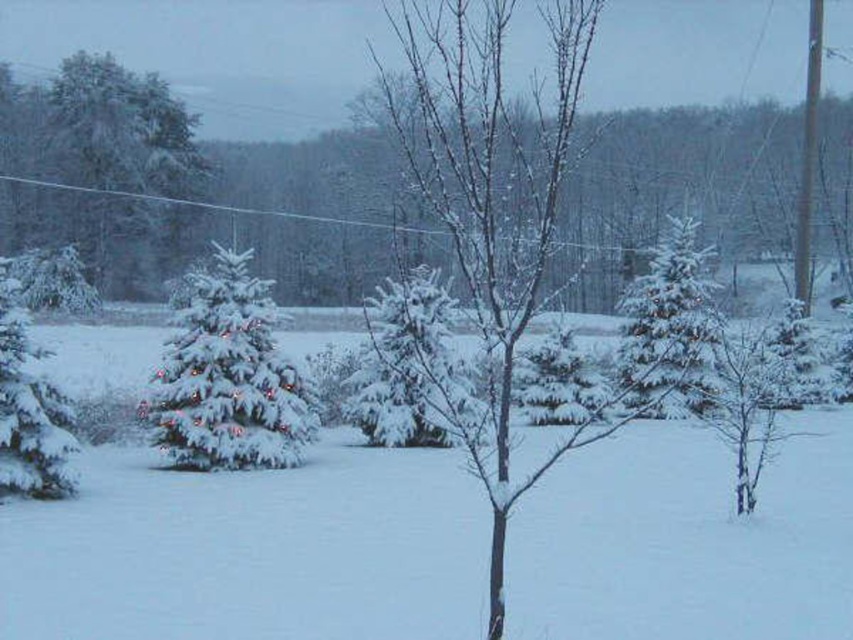
Is the position of green matte evergreen at left more distant than that of smooth bark tree at right?

Yes.

Is point (6, 269) in front of point (766, 369)?

No, it is not.

What do you see at coordinates (28, 406) in the screenshot? I see `green matte evergreen at left` at bounding box center [28, 406].

The height and width of the screenshot is (640, 853). I want to click on green matte evergreen at left, so click(x=28, y=406).

Can you confirm if snow-covered tree at center is shorter than white snow-covered tree at center?

Incorrect, snow-covered tree at center's height does not fall short of white snow-covered tree at center's.

Find the location of a particular element. The image size is (853, 640). snow-covered tree at center is located at coordinates (489, 202).

Can you confirm if green matte evergreen at upper left is positioned to the left of smooth bark tree at right?

Indeed, green matte evergreen at upper left is positioned on the left side of smooth bark tree at right.

Consider the image. Can you confirm if green matte evergreen at upper left is thinner than smooth bark tree at right?

Incorrect, green matte evergreen at upper left's width is not less than smooth bark tree at right's.

Which is in front, point (38, 145) or point (782, 356)?

Point (782, 356) is more forward.

Locate an element on the screen. The width and height of the screenshot is (853, 640). green matte evergreen at upper left is located at coordinates (117, 129).